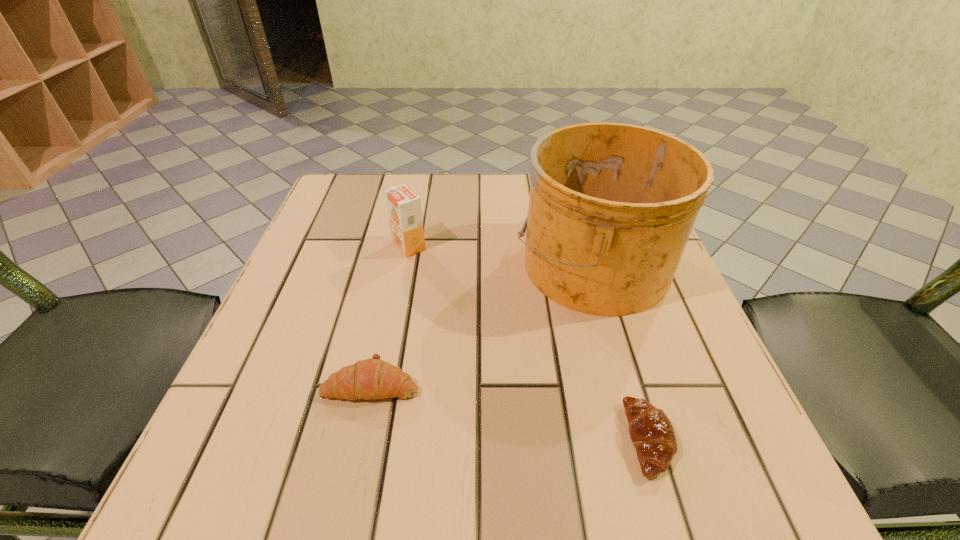
Identify the location of vacant space at the near right corner of the desktop. [674, 496].

Find the location of a particular element. free area in between the left crescent roll and the right crescent roll is located at coordinates (511, 411).

Locate an element on the screen. The height and width of the screenshot is (540, 960). free spot between the right crescent roll and the second tallest object is located at coordinates (529, 343).

Locate an element on the screen. The height and width of the screenshot is (540, 960). vacant space that is in between the bucket and the left crescent roll is located at coordinates (482, 323).

I want to click on free space between the orange juice and the tallest object, so click(501, 255).

I want to click on unoccupied area between the tallest object and the right crescent roll, so click(620, 352).

The height and width of the screenshot is (540, 960). What are the coordinates of `vacant region between the left crescent roll and the tallest object` in the screenshot? It's located at (482, 323).

This screenshot has height=540, width=960. I want to click on vacant region between the tallest object and the orange juice, so click(501, 255).

Where is `unoccupied position between the left crescent roll and the bucket`? unoccupied position between the left crescent roll and the bucket is located at coordinates (482, 323).

In order to click on free point between the right crescent roll and the bucket in this screenshot , I will do `click(620, 352)`.